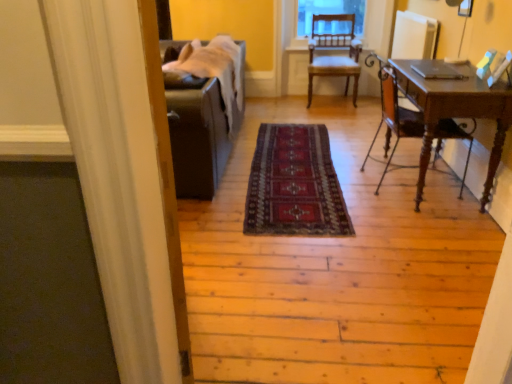
Question: Can you confirm if mahogany wood desk at right, which is the 2th chair in top-to-bottom order, is bigger than wooden chair at center, which is the 2th chair in front-to-back order?

Choices:
 (A) yes
 (B) no

Answer: (B)

Question: Can you confirm if mahogany wood desk at right, the 1th chair when ordered from bottom to top, is positioned to the left of wooden chair at center, which is the 2th chair in front-to-back order?

Choices:
 (A) no
 (B) yes

Answer: (A)

Question: From the image's perspective, does mahogany wood desk at right, the 1th chair when ordered from bottom to top, appear lower than wooden chair at center, which is the 2th chair in front-to-back order?

Choices:
 (A) no
 (B) yes

Answer: (B)

Question: From a real-world perspective, is mahogany wood desk at right, the 1th chair when ordered from bottom to top, below wooden chair at center, arranged as the first chair when viewed from the back?

Choices:
 (A) yes
 (B) no

Answer: (A)

Question: Is mahogany wood desk at right, the first chair positioned from the front, smaller than wooden chair at center, placed as the 1th chair when sorted from top to bottom?

Choices:
 (A) no
 (B) yes

Answer: (B)

Question: Does point (465, 160) appear closer or farther from the camera than point (269, 203)?

Choices:
 (A) closer
 (B) farther

Answer: (B)

Question: Looking at their shapes, would you say mahogany wood desk at right, the first chair positioned from the front, is wider or thinner than dark red woven rug at center?

Choices:
 (A) thin
 (B) wide

Answer: (A)

Question: From the image's perspective, is mahogany wood desk at right, the first chair positioned from the front, located above or below dark red woven rug at center?

Choices:
 (A) below
 (B) above

Answer: (B)

Question: Is mahogany wood desk at right, the first chair positioned from the front, taller or shorter than dark red woven rug at center?

Choices:
 (A) short
 (B) tall

Answer: (B)

Question: From a real-world perspective, is dark red woven rug at center physically located above or below mahogany wood desk at right, acting as the second chair starting from the back?

Choices:
 (A) below
 (B) above

Answer: (A)

Question: Is dark red woven rug at center wider or thinner than mahogany wood desk at right, the first chair positioned from the front?

Choices:
 (A) wide
 (B) thin

Answer: (A)

Question: Does point (318, 175) appear closer or farther from the camera than point (444, 122)?

Choices:
 (A) closer
 (B) farther

Answer: (B)

Question: Based on their positions, is dark red woven rug at center located to the left or right of mahogany wood desk at right, the first chair positioned from the front?

Choices:
 (A) right
 (B) left

Answer: (B)

Question: In the image, is wooden chair at center, which is the 2th chair in front-to-back order, on the left side or the right side of dark red woven rug at center?

Choices:
 (A) right
 (B) left

Answer: (A)

Question: Considering the positions of point (313, 38) and point (289, 200), is point (313, 38) closer or farther from the camera than point (289, 200)?

Choices:
 (A) closer
 (B) farther

Answer: (B)